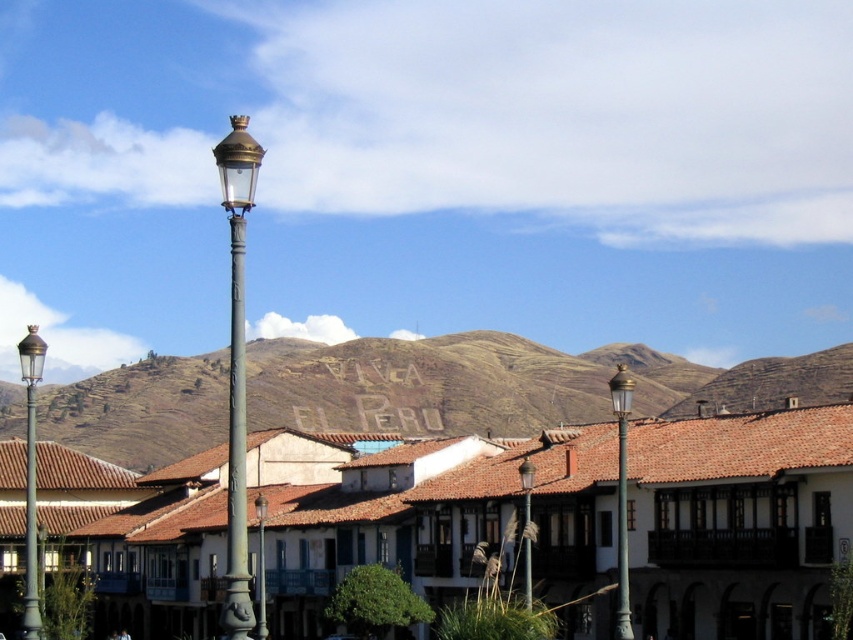
Who is lower down, brushed metal street light at center or bronze textured street light at center?

bronze textured street light at center is lower down.

Which is more to the left, brushed metal street light at center or bronze textured street light at center?

bronze textured street light at center

Does point (525, 464) come farther from viewer compared to point (260, 605)?

That is False.

Find the location of a particular element. brushed metal street light at center is located at coordinates (526, 525).

Between gold-bronze streetlight at center-left and polished metal pole at center-left, which one appears on the right side from the viewer's perspective?

polished metal pole at center-left

The width and height of the screenshot is (853, 640). What do you see at coordinates (236, 368) in the screenshot?
I see `gold-bronze streetlight at center-left` at bounding box center [236, 368].

At what (x,y) coordinates should I click in order to perform the action: click on gold-bronze streetlight at center-left. Please return your answer as a coordinate pair (x, y). Looking at the image, I should click on (236, 368).

At what (x,y) coordinates should I click in order to perform the action: click on gold-bronze streetlight at center-left. Please return your answer as a coordinate pair (x, y). Looking at the image, I should click on (236, 368).

Is brown rocky mountain at center shorter than bronze/golden street light at left?

Yes, brown rocky mountain at center is shorter than bronze/golden street light at left.

Where is `brown rocky mountain at center`? This screenshot has width=853, height=640. brown rocky mountain at center is located at coordinates (506, 384).